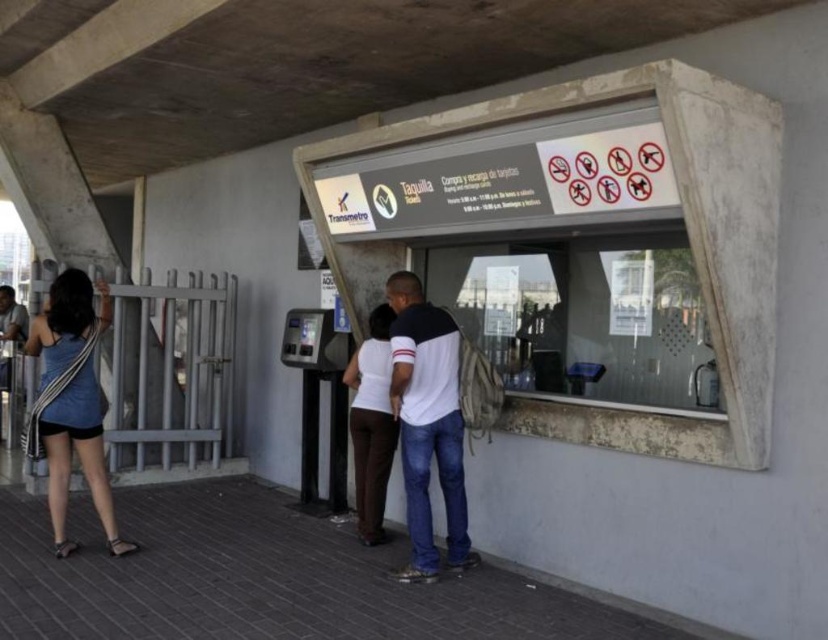
You are a customer standing in front of the ticketing booth at the metro station. You notice a white cotton shirt at center and denim shorts at lower left. Which item is taller?

The white cotton shirt at center is much taller than the denim shorts at lower left.

You are a security guard at the metro station and notice a person wearing a white cotton shirt at center and denim shorts at lower left. According to the prohibited signs above the ticketing booth, which clothing item might be more likely to violate the dress code if the policy requires clothing to have a minimum thickness for safety? Please base your answer on the description provided.

The white cotton shirt at center is thinner than the denim shorts at lower left, so the white cotton shirt at center might be more likely to violate the dress code if the policy requires a minimum thickness for safety.

You are standing in front of the ticketing booth and need to locate two points marked on the booth. The first point is at coordinates point [420,356] and the second point is at point [364,476]. From your perspective, which point is closer to you?

Point [420,356] is in front of point [364,476], so the first point is closer to you.